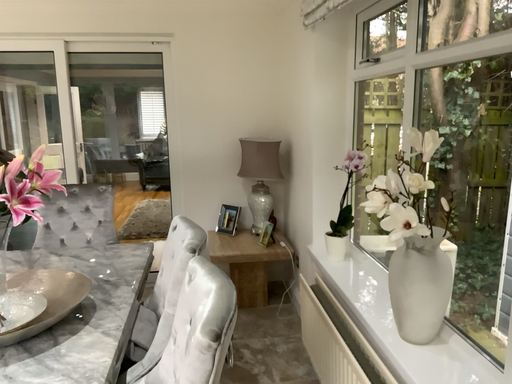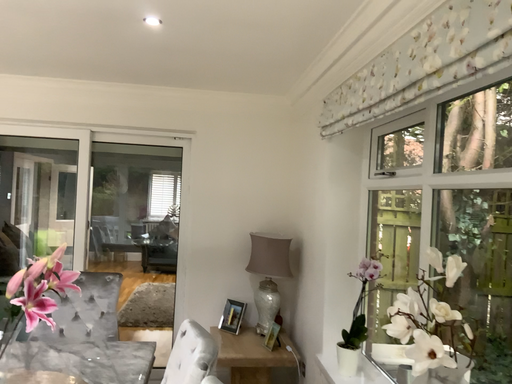
Question: How did the camera likely rotate when shooting the video?

Choices:
 (A) rotated upward
 (B) rotated downward

Answer: (A)